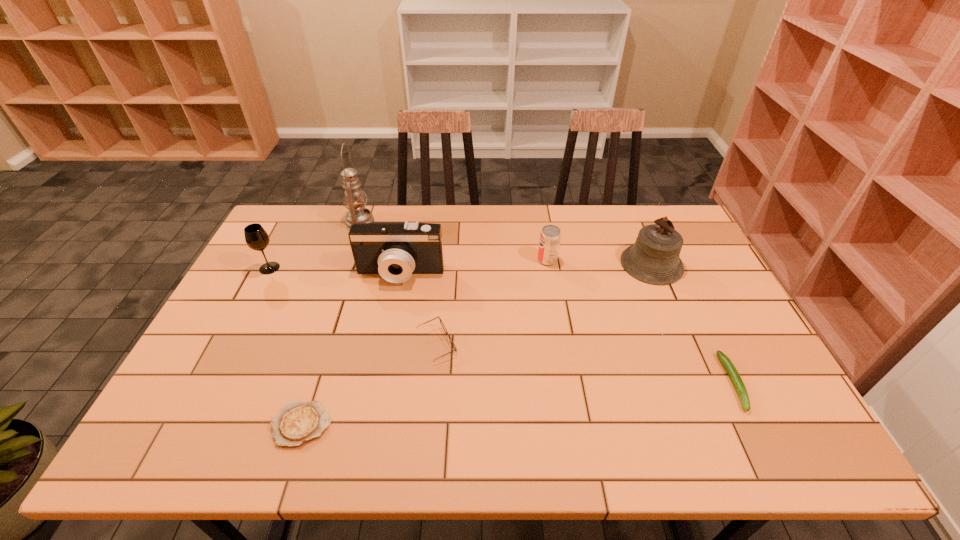
At what (x,y) coordinates should I click in order to perform the action: click on object that ranks as the fifth closest to the farthest object. Please return your answer as a coordinate pair (x, y). Looking at the image, I should click on point(298,422).

Locate an element on the screen. Image resolution: width=960 pixels, height=540 pixels. vacant space that satisfies the following two spatial constraints: 1. on the front side of the fifth tallest object; 2. on the left side of the farthest object is located at coordinates (347, 260).

Locate an element on the screen. The width and height of the screenshot is (960, 540). free space that satisfies the following two spatial constraints: 1. on the front side of the shortest object; 2. on the right side of the tallest object is located at coordinates (291, 424).